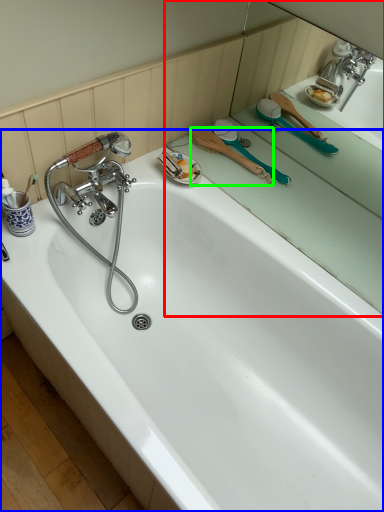
Question: Considering the real-world distances, which object is closest to mirror (highlighted by a red box)? bathtub (highlighted by a blue box) or brush (highlighted by a green box).

Choices:
 (A) bathtub
 (B) brush

Answer: (B)